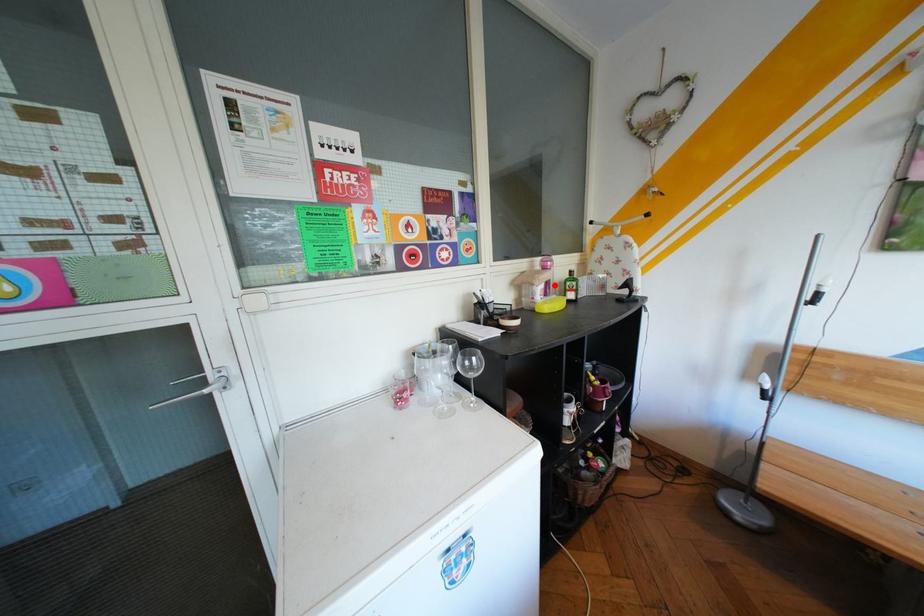
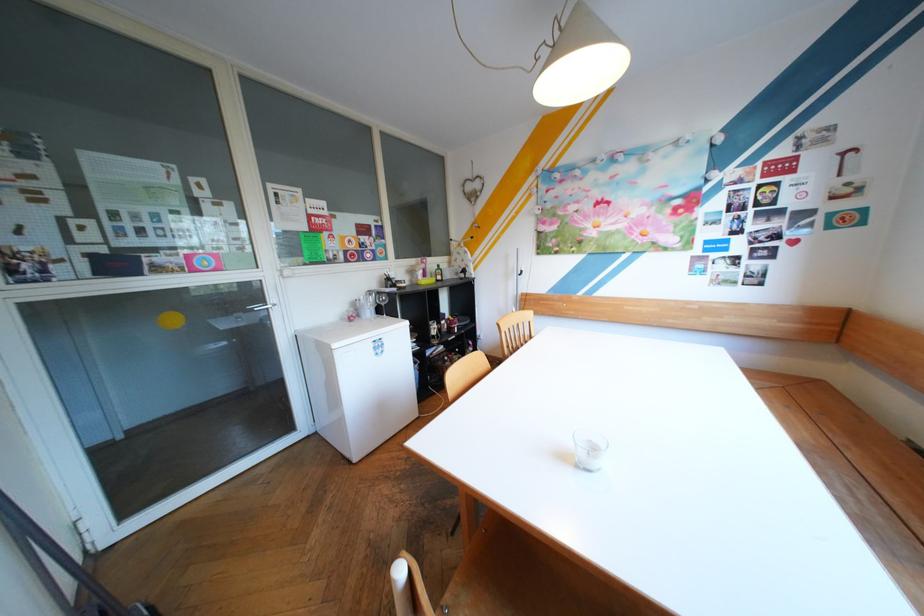
In the second image, find the point that corresponds to the highlighted location in the first image.

(434, 270)